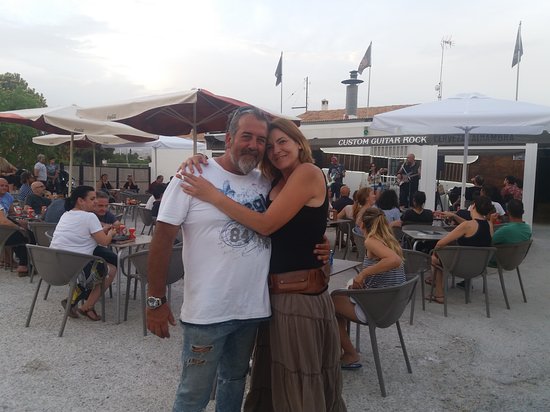
You are a GUI agent. You are given a task and a screenshot of the screen. Output one action in this format:
    pyautogui.click(x=<x>, y=<y>)
    Task: Click on the chimney
    The height and width of the screenshot is (412, 550).
    Given the screenshot: What is the action you would take?
    pyautogui.click(x=352, y=100)